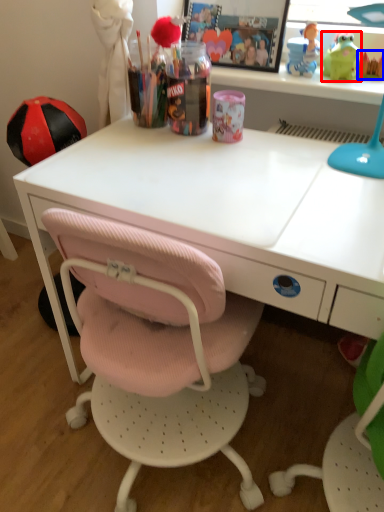
Question: Which object appears farthest to the camera in this image, toy (highlighted by a red box) or toy (highlighted by a blue box)?

Choices:
 (A) toy
 (B) toy

Answer: (B)